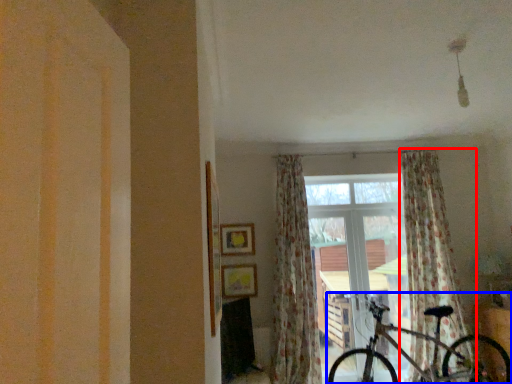
Question: Which object appears closest to the camera in this image, curtain (highlighted by a red box) or bicycle (highlighted by a blue box)?

Choices:
 (A) curtain
 (B) bicycle

Answer: (B)